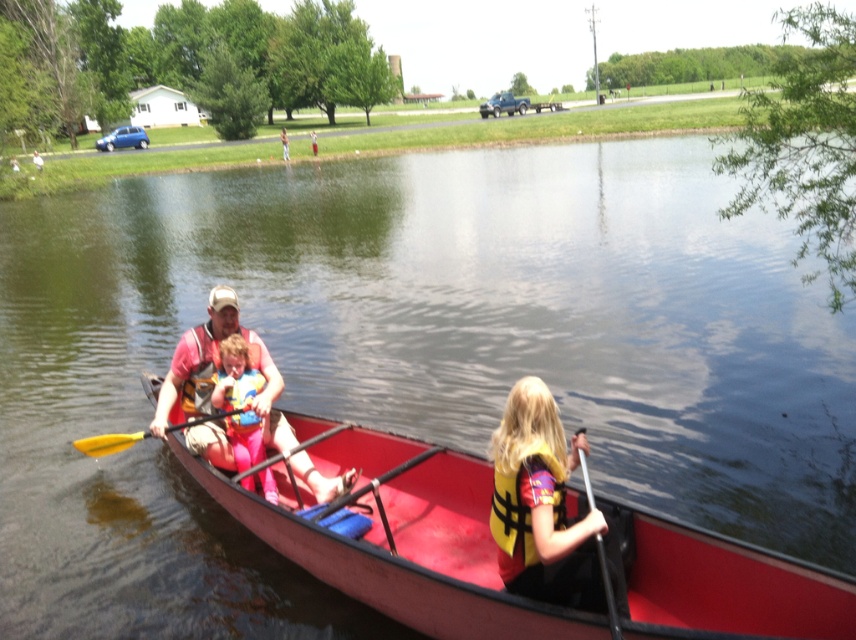
You are a safety inspector checking the canoe for proper equipment placement. According to regulations, life jackets must be easily accessible and not obstructed by other items. Given the positions of the yellow fabric life jacket at lower right and the black plastic paddle at lower right, can you confirm if the life jacket is positioned in a way that it is not blocked by the paddle?

The yellow fabric life jacket at lower right is taller than the black plastic paddle at lower right, meaning the paddle cannot obstruct the life jacket since it is shorter. Therefore, the life jacket is accessible and not blocked by the paddle.

You are a lifeguard at a lake and see the red plastic canoe at center and the matte pink life vest at center in the image. The safety protocol requires that the distance between the canoe and life vest must be less than 36 inches. Is the current distance compliant with the safety protocol?

The distance between the red plastic canoe at center and the matte pink life vest at center is 30.99 inches, which is less than 36 inches. Therefore, the current distance complies with the safety protocol.

You are a safety inspector checking the canoe. You notice the orange life jacket at center and the black plastic paddle at lower right. Which object is taller?

The orange life jacket at center is taller than the black plastic paddle at lower right.